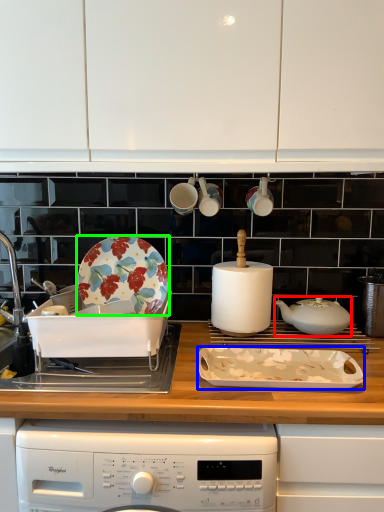
Question: Which object is the farthest from kitchen appliance (highlighted by a red box)? Choose among these: kitchen appliance (highlighted by a blue box) or plate (highlighted by a green box).

Choices:
 (A) kitchen appliance
 (B) plate

Answer: (B)